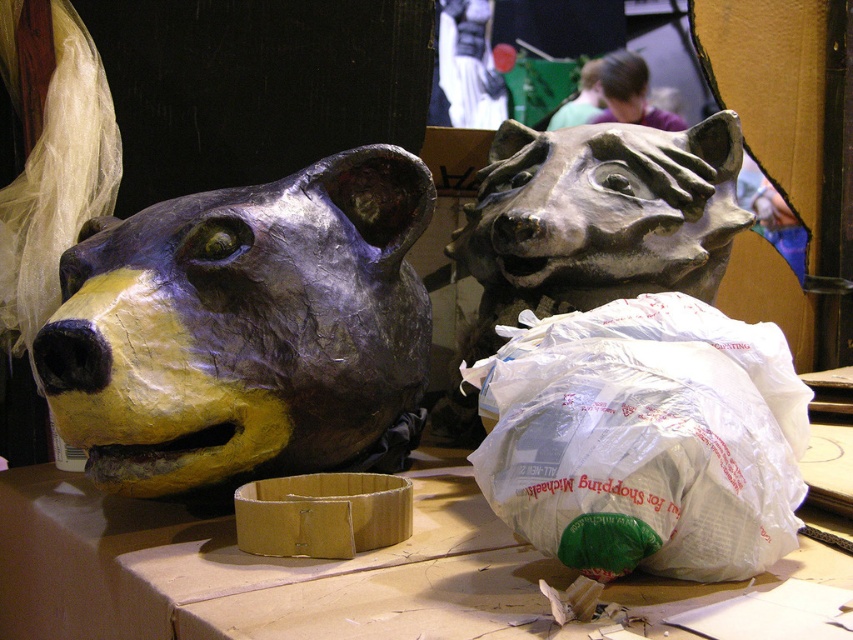
In the scene shown: You are an interior designer planning to place a new decorative item in the workshop. The current setup has a matte papier_mache bear head at left and a grayish_brown bear head at right. You want to position the new item exactly where the point marked at coordinates (242,326) is located. Which existing bear head is closest to this point?

The point marked at coordinates (242,326) is closest to the matte papier_mache bear head at left as it is explicitly marked there.

You are an interior designer arranging items on a shelf. You have a white plastic bag at center and a matte gray bear head at center. If you want to place both items on the same shelf without stacking them, which item should be placed first to ensure they both fit?

The white plastic bag at center has a lesser height compared to the matte gray bear head at center. Since the white plastic bag is shorter, it can be placed first, and the taller matte gray bear head at center can be positioned next to it without exceeding the shelf height limit.

You are organizing a craft fair and need to decide which item to place in a small display box. The box can only fit items that take up minimal space. Based on the scene, which object between the white plastic bag at center and the matte gray bear head at center should you choose?

The white plastic bag at center occupies less space than the matte gray bear head at center, so it should be chosen for the small display box.